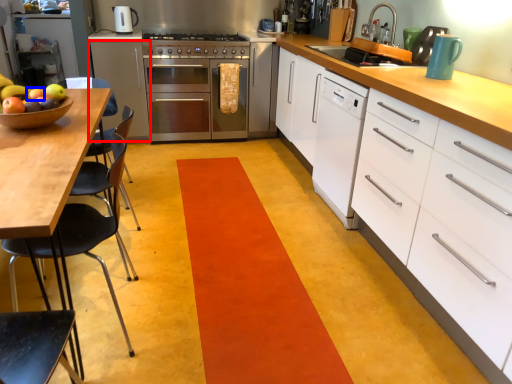
Question: Which object appears farthest to the camera in this image, cabinetry (highlighted by a red box) or apple (highlighted by a blue box)?

Choices:
 (A) cabinetry
 (B) apple

Answer: (A)